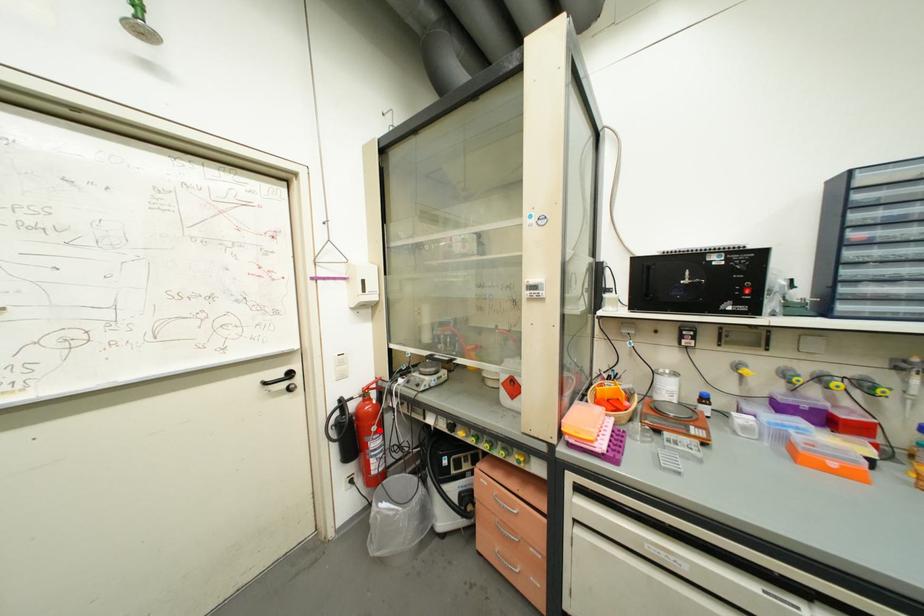
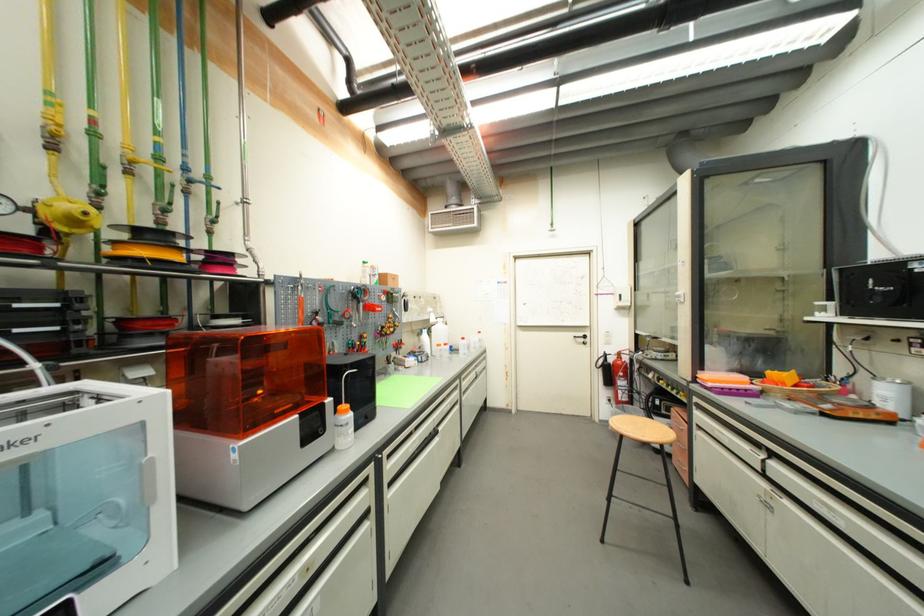
Where in the second image is the point corresponding to the highlighted location from the first image?

(626, 376)